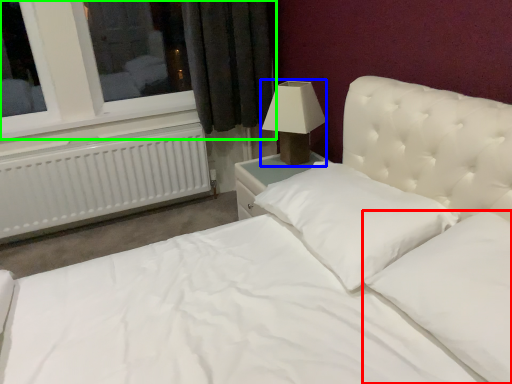
Question: Which object is the farthest from pillow (highlighted by a red box)? Choose among these: lamp (highlighted by a blue box) or window (highlighted by a green box).

Choices:
 (A) lamp
 (B) window

Answer: (B)